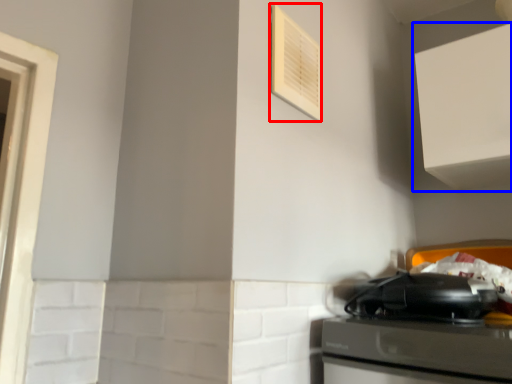
Question: Which of the following is the closest to the observer, air conditioner (highlighted by a red box) or cabinetry (highlighted by a blue box)?

Choices:
 (A) air conditioner
 (B) cabinetry

Answer: (A)